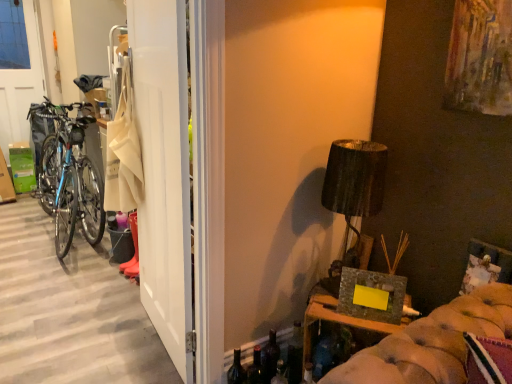
The height and width of the screenshot is (384, 512). What are the coordinates of `shiny blue frame bicycle at left` in the screenshot? It's located at (69, 177).

Locate an element on the screen. translucent glass bottle at lower center, the second bottle viewed from the right is located at coordinates (270, 357).

I want to click on white matte door at left, so click(x=164, y=172).

Is point (59, 177) positioned in front of point (338, 161)?

No, (59, 177) is further to viewer.

Is shiny blue frame bicycle at left positioned far away from matte black lampshade at upper right?

Yes.

Does matte black lampshade at upper right touch transparent plastic screen door at left?

matte black lampshade at upper right and transparent plastic screen door at left are not in contact.

Consider the image. Is matte black lampshade at upper right inside or outside of transparent plastic screen door at left?

matte black lampshade at upper right is spatially situated outside transparent plastic screen door at left.

Between matte black lampshade at upper right and transparent plastic screen door at left, which one is positioned behind?

transparent plastic screen door at left is more distant.

From the image's perspective, which is above, translucent glass bottle at lower center, the second bottle viewed from the right, or transparent plastic screen door at left?

transparent plastic screen door at left.

Is translucent glass bottle at lower center, the second bottle viewed from the right, not close to transparent plastic screen door at left?

Yes.

From a real-world perspective, is translucent glass bottle at lower center, positioned as the 2th bottle in left-to-right order, located beneath transparent plastic screen door at left?

Yes.

Looking at this image, considering the relative positions of translucent glass bottle at lower center, positioned as the 2th bottle in left-to-right order, and transparent plastic screen door at left in the image provided, is translucent glass bottle at lower center, positioned as the 2th bottle in left-to-right order, to the right of transparent plastic screen door at left from the viewer's perspective?

Indeed, translucent glass bottle at lower center, positioned as the 2th bottle in left-to-right order, is positioned on the right side of transparent plastic screen door at left.

From the translucent glass bottle at lower center, the 3th bottle from the right, count 1st bottles backward and point to it. Please provide its 2D coordinates.

[(270, 357)]

Consider the image. Considering the relative positions of translucent glass bottle at lower center, the second bottle viewed from the right, and translucent glass bottle at lower center, acting as the first bottle starting from the left, in the image provided, is translucent glass bottle at lower center, the second bottle viewed from the right, to the left or to the right of translucent glass bottle at lower center, acting as the first bottle starting from the left,?

In the image, translucent glass bottle at lower center, the second bottle viewed from the right, appears on the right side of translucent glass bottle at lower center, acting as the first bottle starting from the left.

From a real-world perspective, who is located higher, translucent glass bottle at lower center, the second bottle viewed from the right, or translucent glass bottle at lower center, the 3th bottle from the right?

translucent glass bottle at lower center, the second bottle viewed from the right.

Considering the sizes of translucent glass bottle at lower center, the second bottle viewed from the right, and translucent glass bottle at lower center, acting as the first bottle starting from the left, in the image, is translucent glass bottle at lower center, the second bottle viewed from the right, wider or thinner than translucent glass bottle at lower center, acting as the first bottle starting from the left,?

translucent glass bottle at lower center, the second bottle viewed from the right, is thinner than translucent glass bottle at lower center, acting as the first bottle starting from the left.

From a real-world perspective, between white matte door at left and translucent glass bottle at lower center, positioned as the 2th bottle in left-to-right order, who is vertically higher?

white matte door at left is physically above.

Who is bigger, white matte door at left or translucent glass bottle at lower center, positioned as the 2th bottle in left-to-right order?

Bigger between the two is white matte door at left.

Where is `door above the translucent glass bottle at lower center, the second bottle viewed from the right (from a real-world perspective)`? This screenshot has height=384, width=512. door above the translucent glass bottle at lower center, the second bottle viewed from the right (from a real-world perspective) is located at coordinates (164, 172).

What are the coordinates of `furniture below the shiny blue frame bicycle at left (from the image's perspective)` in the screenshot? It's located at (335, 321).

Is shiny blue frame bicycle at left surrounding stone-like textured frame at lower right?

Actually, stone-like textured frame at lower right is outside shiny blue frame bicycle at left.

Relative to stone-like textured frame at lower right, is shiny blue frame bicycle at left in front or behind?

Clearly, shiny blue frame bicycle at left is behind stone-like textured frame at lower right.

Which point is more forward, (80, 175) or (308, 329)?

The point (308, 329) is more forward.

Is translucent glass bottle at lower center, arranged as the third bottle when viewed from the left, bigger than matte black lampshade at upper right?

No.

I want to click on lamp that is above the translucent glass bottle at lower center, the first bottle positioned from the right (from a real-world perspective), so click(x=355, y=185).

Who is more distant, translucent glass bottle at lower center, arranged as the third bottle when viewed from the left, or matte black lampshade at upper right?

translucent glass bottle at lower center, arranged as the third bottle when viewed from the left, is further from the camera.

How many degrees apart are the facing directions of translucent glass bottle at lower center, arranged as the third bottle when viewed from the left, and matte black lampshade at upper right?

There is a 19.9-degree angle between the facing directions of translucent glass bottle at lower center, arranged as the third bottle when viewed from the left, and matte black lampshade at upper right.

The width and height of the screenshot is (512, 384). In the image, there is a matte black lampshade at upper right. Identify the location of bicycle below it (from a real-world perspective). (69, 177).

Where is `lamp in front of the transparent plastic screen door at left`? Image resolution: width=512 pixels, height=384 pixels. lamp in front of the transparent plastic screen door at left is located at coordinates (355, 185).

When comparing their distances from transparent plastic screen door at left, does matte black lampshade at upper right or white matte door at left seem closer?

Based on the image, white matte door at left appears to be nearer to transparent plastic screen door at left.

When comparing their distances from transparent plastic screen door at left, does translucent glass bottle at lower center, the second bottle viewed from the right, or translucent glass bottle at lower center, acting as the first bottle starting from the left, seem closer?

Based on the image, translucent glass bottle at lower center, acting as the first bottle starting from the left, appears to be nearer to transparent plastic screen door at left.

When comparing their distances from translucent glass bottle at lower center, the first bottle positioned from the right, does translucent glass bottle at lower center, positioned as the 2th bottle in left-to-right order, or transparent plastic screen door at left seem closer?

translucent glass bottle at lower center, positioned as the 2th bottle in left-to-right order, is closer to translucent glass bottle at lower center, the first bottle positioned from the right.

Considering their positions, is translucent glass bottle at lower center, the 3th bottle from the right, positioned further to matte black lampshade at upper right than translucent glass bottle at lower center, arranged as the third bottle when viewed from the left?

Among the two, translucent glass bottle at lower center, the 3th bottle from the right, is located further to matte black lampshade at upper right.

Which object lies nearer to the anchor point translucent glass bottle at lower center, acting as the first bottle starting from the left, translucent glass bottle at lower center, the first bottle positioned from the right, or matte black lampshade at upper right?

Based on the image, translucent glass bottle at lower center, the first bottle positioned from the right, appears to be nearer to translucent glass bottle at lower center, acting as the first bottle starting from the left.

Which object lies nearer to the anchor point white matte door at left, shiny blue frame bicycle at left or transparent plastic screen door at left?

Based on the image, shiny blue frame bicycle at left appears to be nearer to white matte door at left.

Considering their positions, is matte black lampshade at upper right positioned further to translucent glass bottle at lower center, arranged as the third bottle when viewed from the left, than white matte door at left?

The object further to translucent glass bottle at lower center, arranged as the third bottle when viewed from the left, is white matte door at left.

Based on their spatial positions, is matte black lampshade at upper right or translucent glass bottle at lower center, positioned as the 2th bottle in left-to-right order, further from stone-like textured frame at lower right?

The object further to stone-like textured frame at lower right is matte black lampshade at upper right.

I want to click on door between shiny blue frame bicycle at left and translucent glass bottle at lower center, acting as the first bottle starting from the left, in the horizontal direction, so click(x=164, y=172).

This screenshot has height=384, width=512. Identify the location of bicycle between transparent plastic screen door at left and translucent glass bottle at lower center, the 3th bottle from the right, from left to right. (69, 177).

At what (x,y) coordinates should I click in order to perform the action: click on door situated between shiny blue frame bicycle at left and stone-like textured frame at lower right from left to right. Please return your answer as a coordinate pair (x, y). This screenshot has height=384, width=512. Looking at the image, I should click on (164, 172).

Identify the location of door between shiny blue frame bicycle at left and translucent glass bottle at lower center, arranged as the third bottle when viewed from the left, from left to right. The width and height of the screenshot is (512, 384). (164, 172).